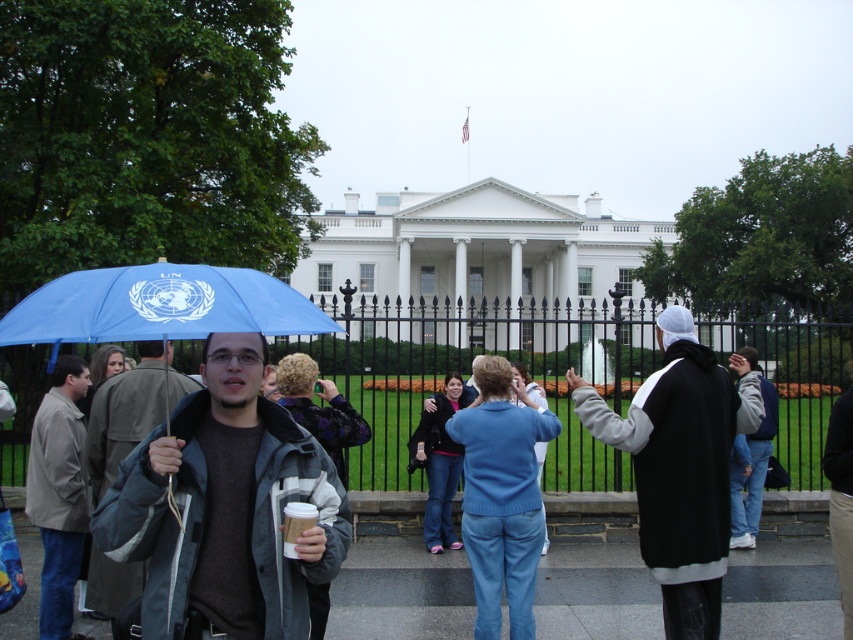
Does blue matte umbrella at left appear on the right side of light brown leather jacket at left?

Yes, blue matte umbrella at left is to the right of light brown leather jacket at left.

This screenshot has width=853, height=640. Find the location of `blue matte umbrella at left`. blue matte umbrella at left is located at coordinates (158, 305).

What do you see at coordinates (158, 305) in the screenshot? The image size is (853, 640). I see `blue matte umbrella at left` at bounding box center [158, 305].

Where is `blue matte umbrella at left`? blue matte umbrella at left is located at coordinates (158, 305).

Which is behind, point (20, 314) or point (146, 394)?

The point (146, 394) is more distant.

Can you confirm if blue matte umbrella at left is positioned above gray fabric jacket at center?

Indeed, blue matte umbrella at left is positioned over gray fabric jacket at center.

Which is in front, point (268, 301) or point (148, 410)?

Positioned in front is point (268, 301).

The image size is (853, 640). In order to click on blue matte umbrella at left in this screenshot , I will do `click(158, 305)`.

Does black fleece jacket at center appear under gray fabric jacket at center?

No, black fleece jacket at center is not below gray fabric jacket at center.

Between black fleece jacket at center and gray fabric jacket at center, which one is positioned higher?

black fleece jacket at center

Who is more distant from viewer, (593,420) or (108,589)?

The point (593,420) is behind.

At what (x,y) coordinates should I click in order to perform the action: click on black fleece jacket at center. Please return your answer as a coordinate pair (x, y). This screenshot has height=640, width=853. Looking at the image, I should click on [x=680, y=467].